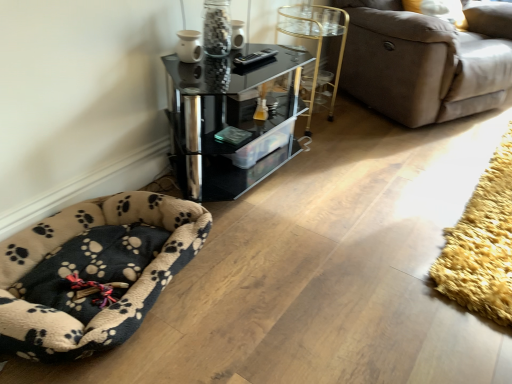
You are a GUI agent. You are given a task and a screenshot of the screen. Output one action in this format:
    pyautogui.click(x=<x>, y=<y>)
    Task: Click on the vacant space in between yellow shaggy rug at lower right and beige fleece dog bed at lower left
    The height and width of the screenshot is (384, 512).
    Given the screenshot: What is the action you would take?
    pyautogui.click(x=359, y=216)